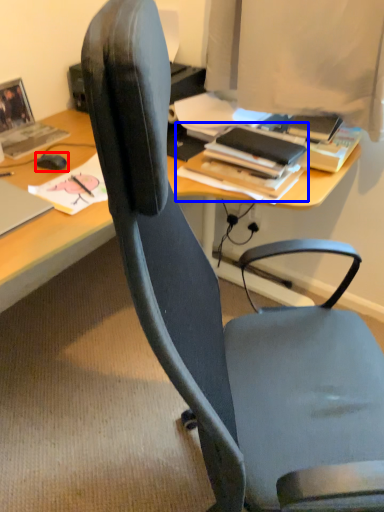
Question: Among these objects, which one is farthest to the camera, mouse (highlighted by a red box) or book (highlighted by a blue box)?

Choices:
 (A) mouse
 (B) book

Answer: (A)